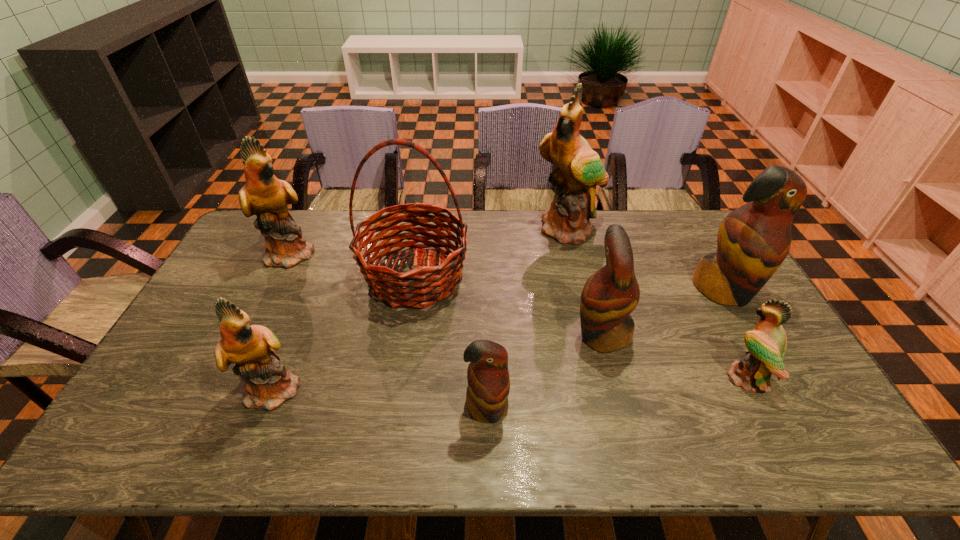
Locate an element on the screen. This screenshot has height=540, width=960. free spot between the third biggest green parrot and the second farthest red parrot is located at coordinates (439, 361).

Locate an element on the screen. free space that is in between the second red parrot from right to left and the smallest green parrot is located at coordinates coord(674,356).

You are a GUI agent. You are given a task and a screenshot of the screen. Output one action in this format:
    pyautogui.click(x=<x>, y=<y>)
    Task: Click on the object that is the nearest to the second green parrot from right to left
    The image size is (960, 540).
    Given the screenshot: What is the action you would take?
    pyautogui.click(x=421, y=287)

Select which object appears as the seventh closest to the tallest parrot. Please provide its 2D coordinates. Your answer should be formatted as a tuple, i.e. [(x, y)], where the tuple contains the x and y coordinates of a point satisfying the conditions above.

[(268, 383)]

Identify the location of the fourth closest parrot to the fourth farthest parrot. (580, 169).

Where is `the closest parrot to the fifth parrot from right to left`? The height and width of the screenshot is (540, 960). the closest parrot to the fifth parrot from right to left is located at coordinates (609, 296).

In order to click on green parrot that stands as the second closest to the rightmost green parrot in this screenshot , I will do `click(268, 383)`.

Identify the location of green parrot that can be found as the closest to the third biggest green parrot. (264, 195).

The height and width of the screenshot is (540, 960). I want to click on red parrot that can be found as the third closest to the second smallest green parrot, so click(753, 240).

Where is `red parrot that stands as the second closest to the tallest parrot`? This screenshot has width=960, height=540. red parrot that stands as the second closest to the tallest parrot is located at coordinates (609, 296).